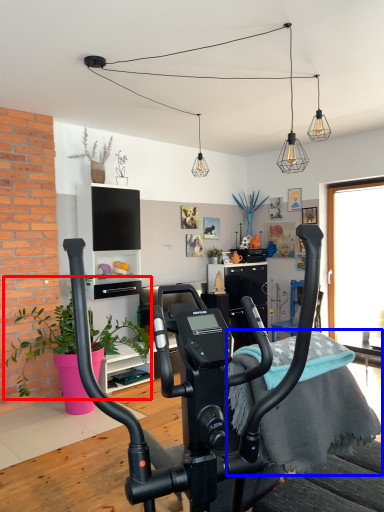
Question: Which object is further to the camera taking this photo, plant (highlighted by a red box) or bedding (highlighted by a blue box)?

Choices:
 (A) plant
 (B) bedding

Answer: (A)